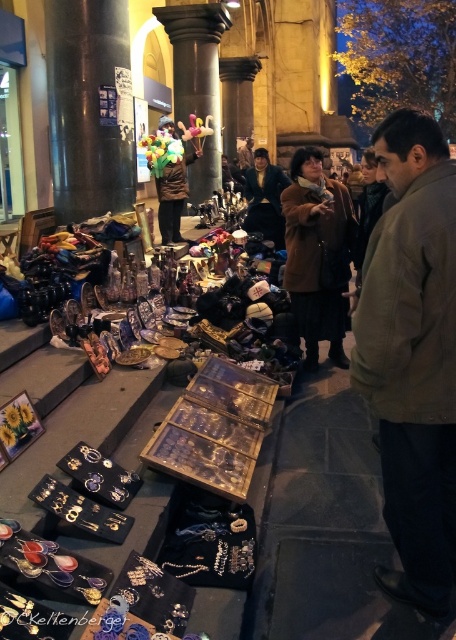
Question: Can you confirm if brown woolen jacket at right is positioned below velvet brown coat at center?

Choices:
 (A) no
 (B) yes

Answer: (B)

Question: Does brown woolen jacket at right have a smaller size compared to velvet brown coat at center?

Choices:
 (A) no
 (B) yes

Answer: (B)

Question: Does brown woolen jacket at right have a smaller size compared to velvet brown coat at center?

Choices:
 (A) no
 (B) yes

Answer: (B)

Question: Which of the following is the farthest from the observer?

Choices:
 (A) (250, 188)
 (B) (409, 385)

Answer: (A)

Question: Which object is farther from the camera taking this photo?

Choices:
 (A) velvet brown coat at center
 (B) brown woolen jacket at right

Answer: (A)

Question: Among these points, which one is nearest to the camera?

Choices:
 (A) (415, 380)
 (B) (274, 180)

Answer: (A)